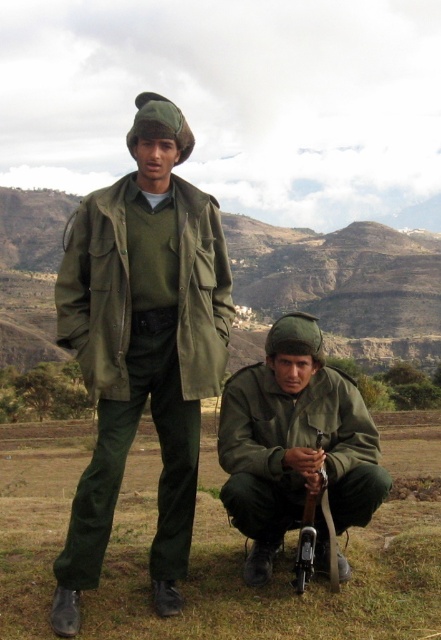
Question: Which object appears farthest from the camera in this image?

Choices:
 (A) matte green uniform at center
 (B) matte green uniform at lower center

Answer: (B)

Question: Which of the following is the closest to the observer?

Choices:
 (A) (230, 496)
 (B) (167, 209)

Answer: (A)

Question: Which of the following is the closest to the observer?

Choices:
 (A) (52, 612)
 (B) (340, 460)

Answer: (A)

Question: Is matte green uniform at center to the left of matte green uniform at lower center from the viewer's perspective?

Choices:
 (A) no
 (B) yes

Answer: (B)

Question: Does matte green uniform at center appear under matte green uniform at lower center?

Choices:
 (A) no
 (B) yes

Answer: (B)

Question: Can you confirm if matte green uniform at center is positioned to the left of matte green uniform at lower center?

Choices:
 (A) yes
 (B) no

Answer: (A)